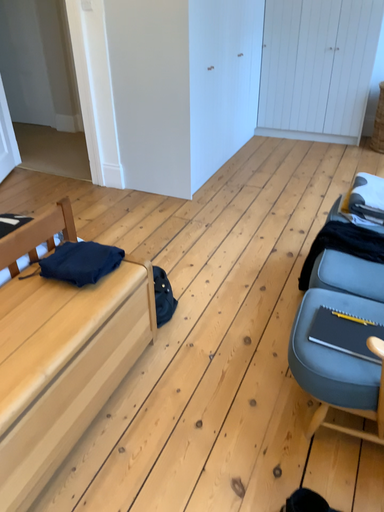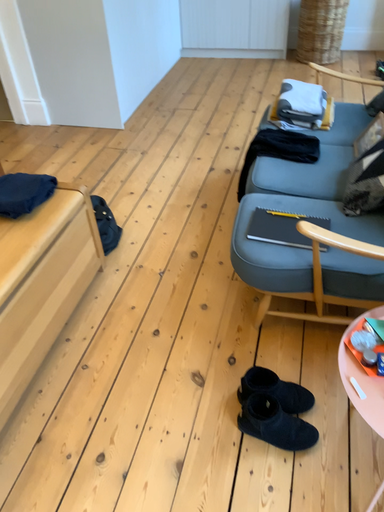
Question: Which way did the camera rotate in the video?

Choices:
 (A) rotated left
 (B) rotated right

Answer: (B)